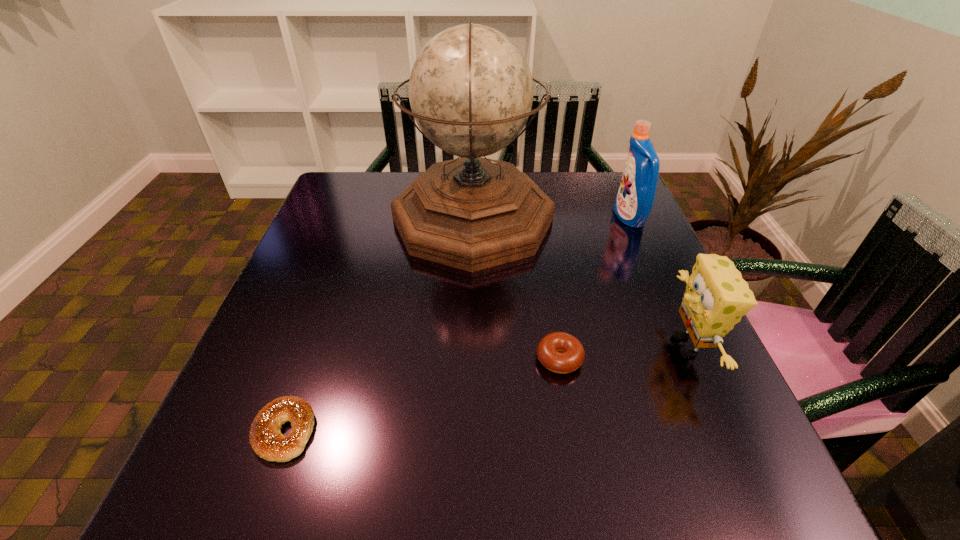
Locate an element on the screen. free space that is in between the shortest object and the doughnut is located at coordinates (421, 395).

You are a GUI agent. You are given a task and a screenshot of the screen. Output one action in this format:
    pyautogui.click(x=<x>, y=<y>)
    Task: Click on the vacant region between the sponge and the shortest object
    
    Given the screenshot: What is the action you would take?
    pyautogui.click(x=485, y=388)

Identify the location of vacant area that lies between the leftmost object and the globe. (378, 325).

Locate an element on the screen. vacant space in between the shortest object and the fourth tallest object is located at coordinates (421, 395).

Identify the location of free space between the third tallest object and the second shortest object. The image size is (960, 540). (623, 352).

This screenshot has height=540, width=960. I want to click on free spot between the sponge and the doughnut, so click(623, 352).

Locate an element on the screen. vacant space that's between the sponge and the detergent is located at coordinates (658, 282).

Find the location of `vacant space in between the sponge and the globe`. vacant space in between the sponge and the globe is located at coordinates (580, 282).

Locate which object is the fourth closest to the second shortest object. Please provide its 2D coordinates. Your answer should be formatted as a tuple, i.e. [(x, y)], where the tuple contains the x and y coordinates of a point satisfying the conditions above.

[(635, 198)]

Point out which object is positioned as the fourth nearest to the second shortest object. Please provide its 2D coordinates. Your answer should be formatted as a tuple, i.e. [(x, y)], where the tuple contains the x and y coordinates of a point satisfying the conditions above.

[(635, 198)]